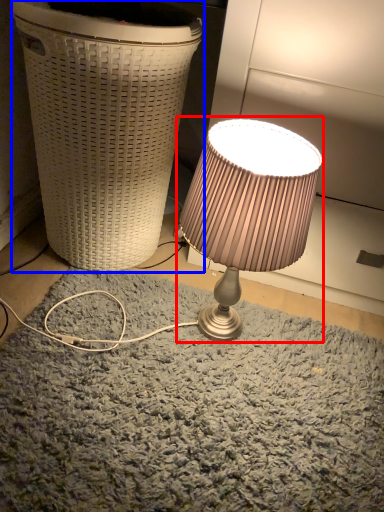
Question: Which object is further to the camera taking this photo, lamp (highlighted by a red box) or waste container (highlighted by a blue box)?

Choices:
 (A) lamp
 (B) waste container

Answer: (B)